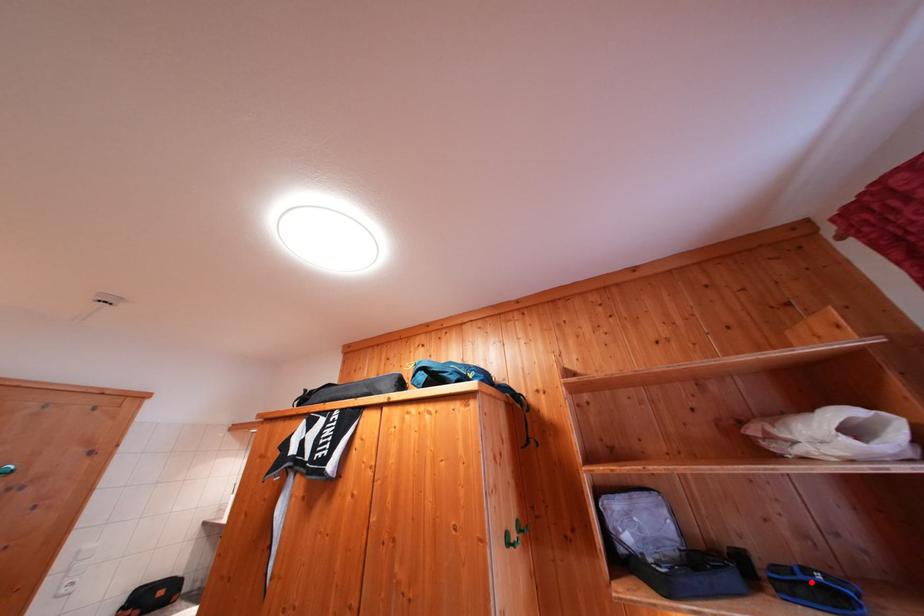
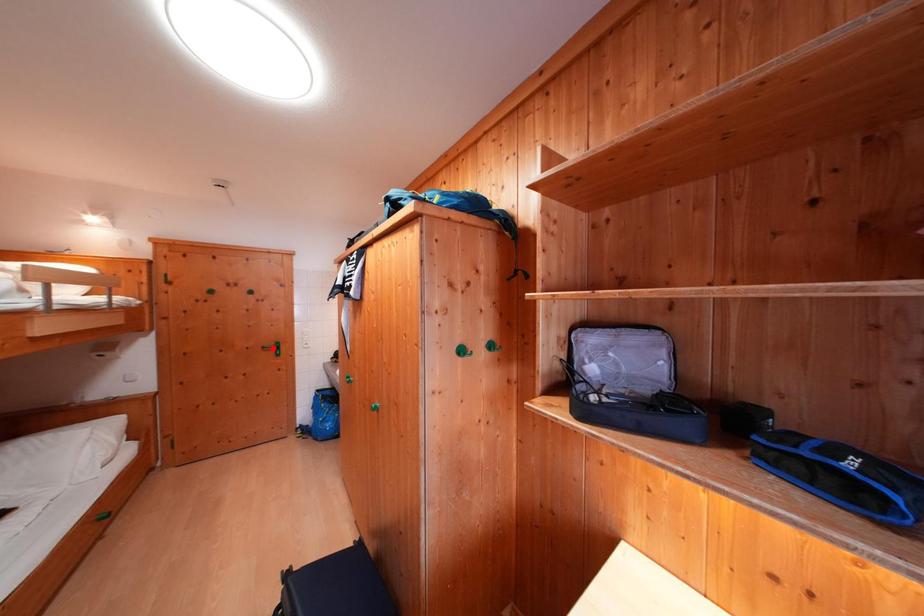
I am providing you with two images of the same scene from different viewpoints. A red point is marked on the first image and another point is marked on the second image. Is the marked point in image1 the same physical position as the marked point in image2?

No